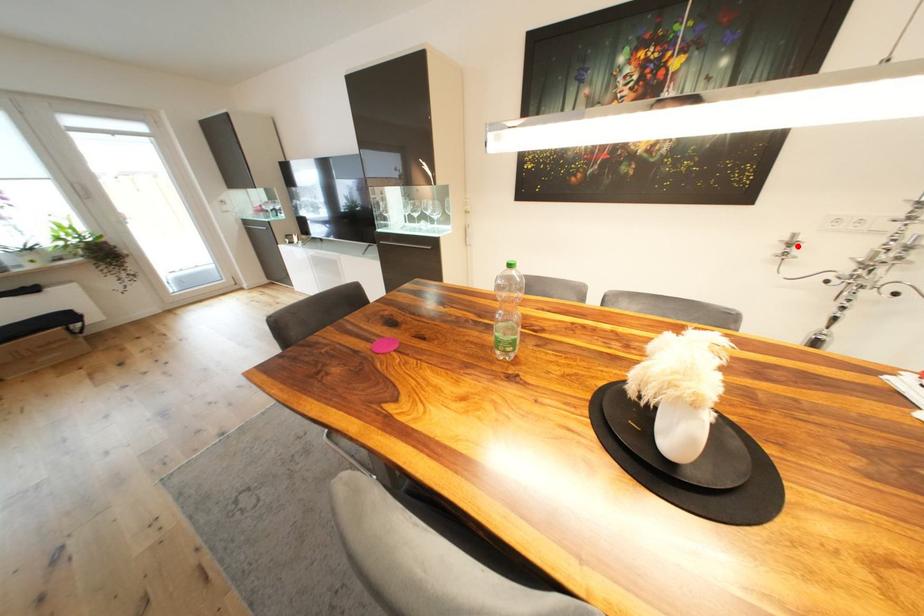
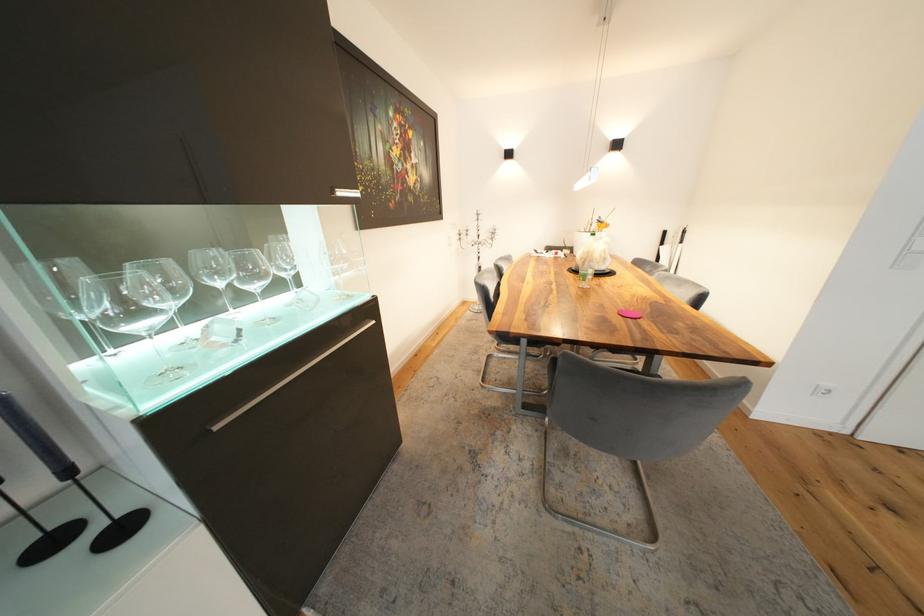
Locate, in the second image, the point that corresponds to the highlighted location in the first image.

(467, 236)